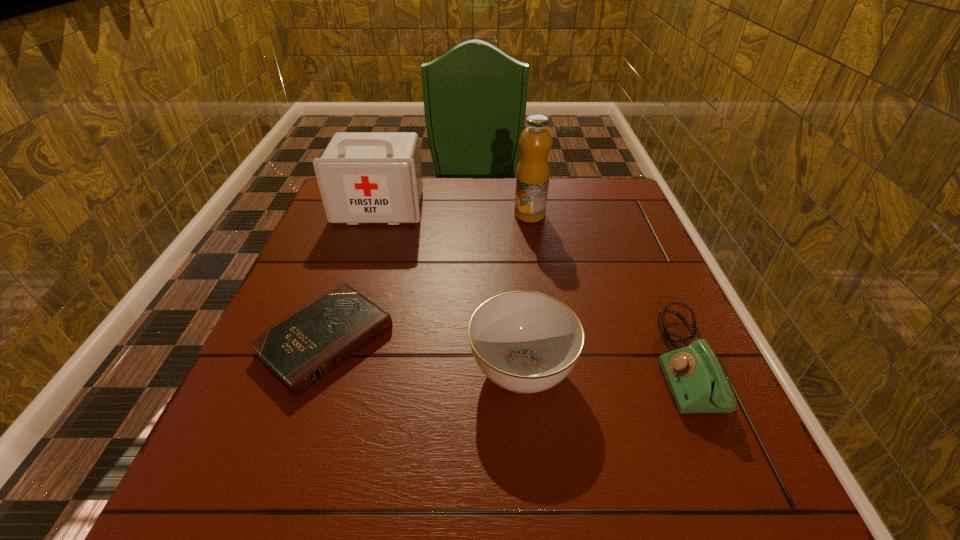
This screenshot has width=960, height=540. What are the coordinates of `the tallest object` in the screenshot? It's located at (532, 178).

This screenshot has width=960, height=540. I want to click on the fourth shortest object, so click(x=364, y=177).

At what (x,y) coordinates should I click in order to perform the action: click on chinaware. Please return your answer as a coordinate pair (x, y). Looking at the image, I should click on [x=526, y=342].

At what (x,y) coordinates should I click in order to perform the action: click on the rightmost object. Please return your answer as a coordinate pair (x, y). This screenshot has width=960, height=540. Looking at the image, I should click on (697, 382).

Where is `telephone`? This screenshot has height=540, width=960. telephone is located at coordinates (697, 382).

Where is `Bible`? The image size is (960, 540). Bible is located at coordinates (300, 351).

Identify the location of blank space located 0.100m on the front label of the fruit juice. (x=535, y=246).

What are the coordinates of `vacant space located on the front-facing side of the first-aid kit` in the screenshot? It's located at (353, 289).

Find the location of a particular element. free space located 0.130m on the front of the third tallest object is located at coordinates (533, 496).

The image size is (960, 540). Find the location of `vacant space located on the dial of the telephone`. vacant space located on the dial of the telephone is located at coordinates (521, 361).